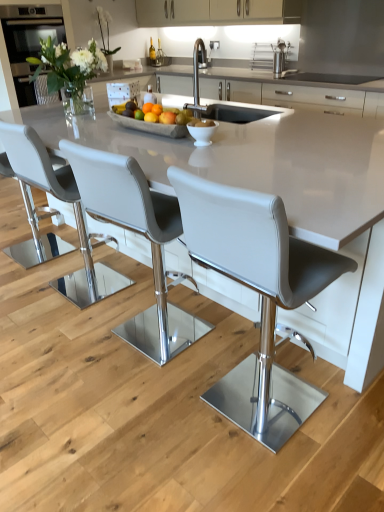
Locate an element on the screen. This screenshot has width=384, height=512. free space in front of white leather stool at center, marked as the third chair in a left-to-right arrangement is located at coordinates (137, 399).